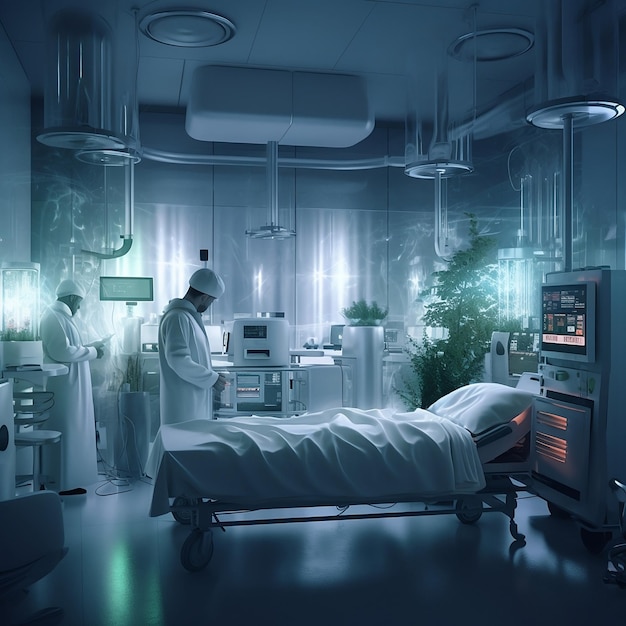
The width and height of the screenshot is (626, 626). Find the location of `monitor`. monitor is located at coordinates (126, 288).